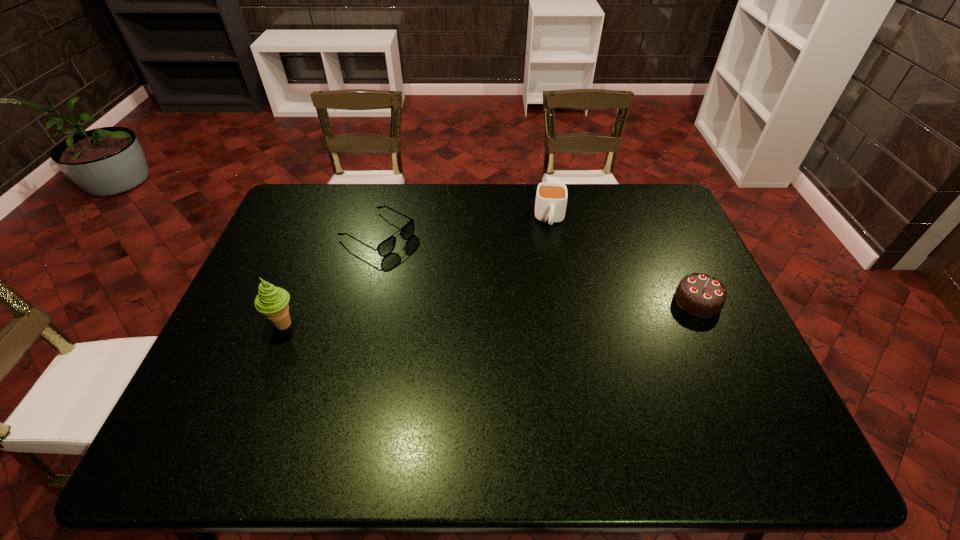
The width and height of the screenshot is (960, 540). Identify the location of free region at the left edge of the desktop. (264, 262).

You are a GUI agent. You are given a task and a screenshot of the screen. Output one action in this format:
    pyautogui.click(x=<x>, y=<y>)
    Task: Click on the blank space at the right edge of the desktop
    
    Given the screenshot: What is the action you would take?
    pyautogui.click(x=702, y=262)

In the image, there is a desktop. Identify the location of vacant space at the far right corner. Image resolution: width=960 pixels, height=540 pixels. (652, 222).

Where is `empty space between the cup and the rightmost object`? empty space between the cup and the rightmost object is located at coordinates (624, 260).

The width and height of the screenshot is (960, 540). In order to click on vacant region between the chocolate cake and the spectacles in this screenshot , I will do `click(538, 268)`.

You are a GUI agent. You are given a task and a screenshot of the screen. Output one action in this format:
    pyautogui.click(x=<x>, y=<y>)
    Task: Click on the vacant space that is in between the third object from left to right and the chocolate cake
    Image resolution: width=960 pixels, height=540 pixels.
    Given the screenshot: What is the action you would take?
    pyautogui.click(x=624, y=260)

Where is `vacant point located between the cup and the shortest object`? vacant point located between the cup and the shortest object is located at coordinates (464, 227).

Locate an element on the screen. The height and width of the screenshot is (540, 960). free space between the cup and the icecream is located at coordinates (417, 272).

The image size is (960, 540). In order to click on vacant space in between the shortest object and the icecream in this screenshot , I will do `click(331, 279)`.

Find the location of a particular element. The width and height of the screenshot is (960, 540). free space between the spectacles and the rightmost object is located at coordinates (538, 268).